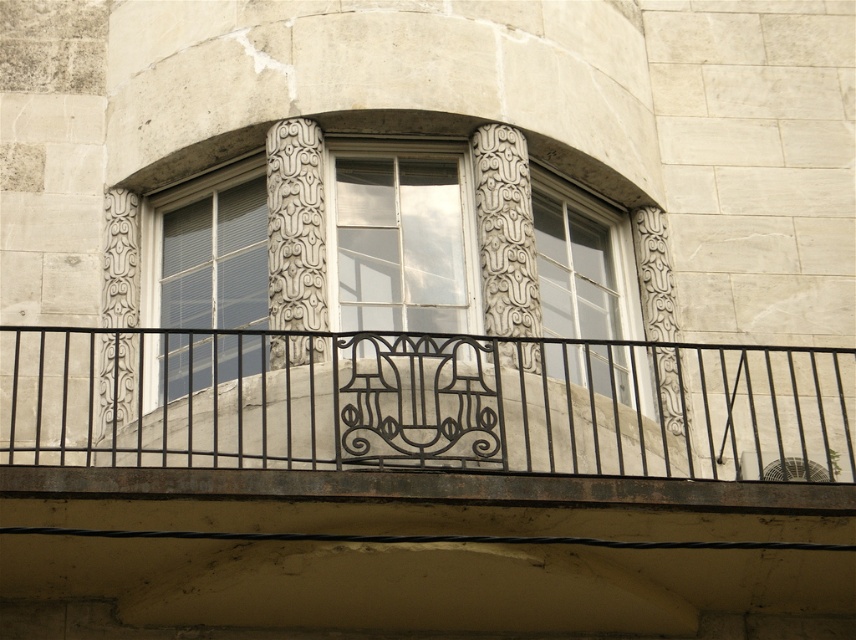
You are an architect designing a new building and want to ensure that the black wrought iron balcony at center and the white glass window at center are proportionally balanced. Given their current heights, which object should you consider shortening to achieve better visual harmony?

The black wrought iron balcony at center is much taller than the white glass window at center, so shortening the black wrought iron balcony at center would help achieve better visual harmony.